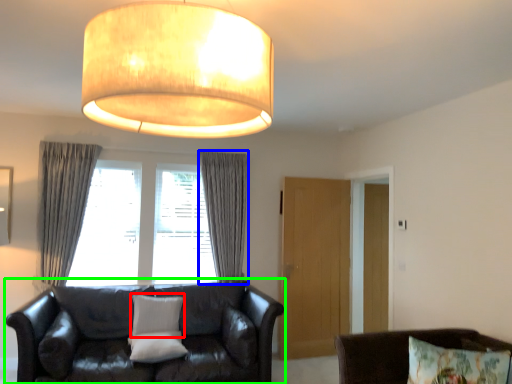
Question: Estimate the real-world distances between objects in this image. Which object is closer to pillow (highlighted by a red box), curtain (highlighted by a blue box) or studio couch (highlighted by a green box)?

Choices:
 (A) curtain
 (B) studio couch

Answer: (B)